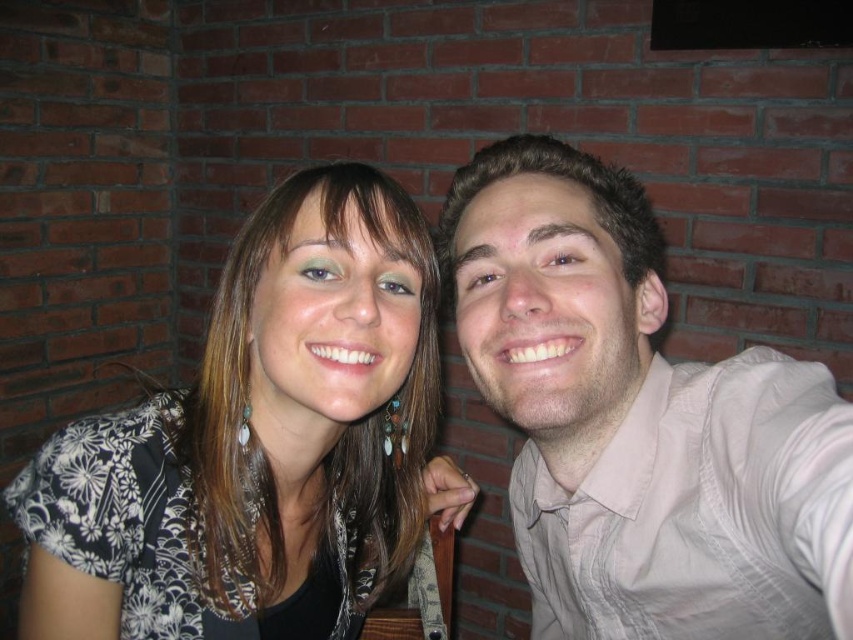
Measure the distance between floral-patterned blouse at center and light beige shirt at right.

The distance of floral-patterned blouse at center from light beige shirt at right is 19.27 centimeters.

Is point (137, 433) closer to camera compared to point (648, 538)?

No, it is not.

The image size is (853, 640). Identify the location of floral-patterned blouse at center. (260, 444).